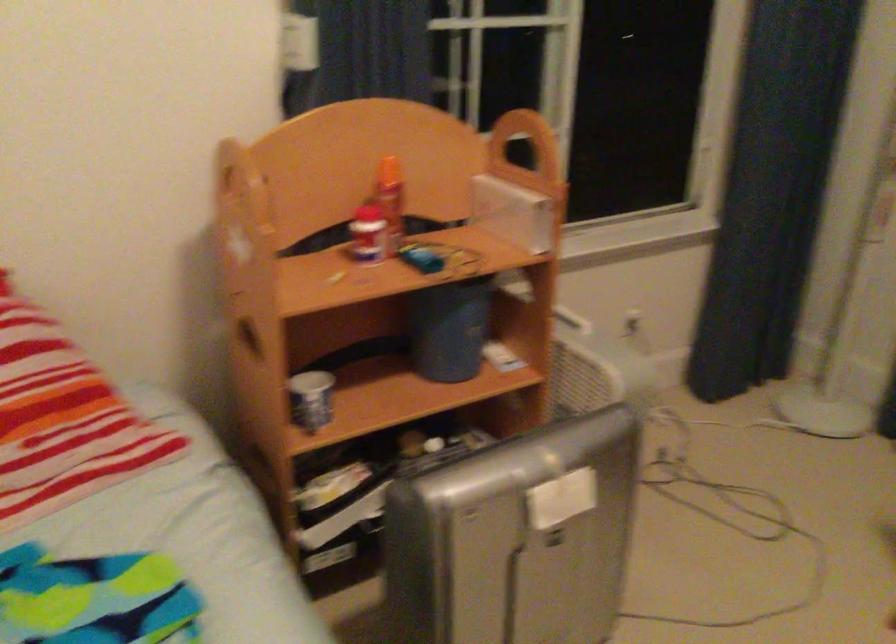
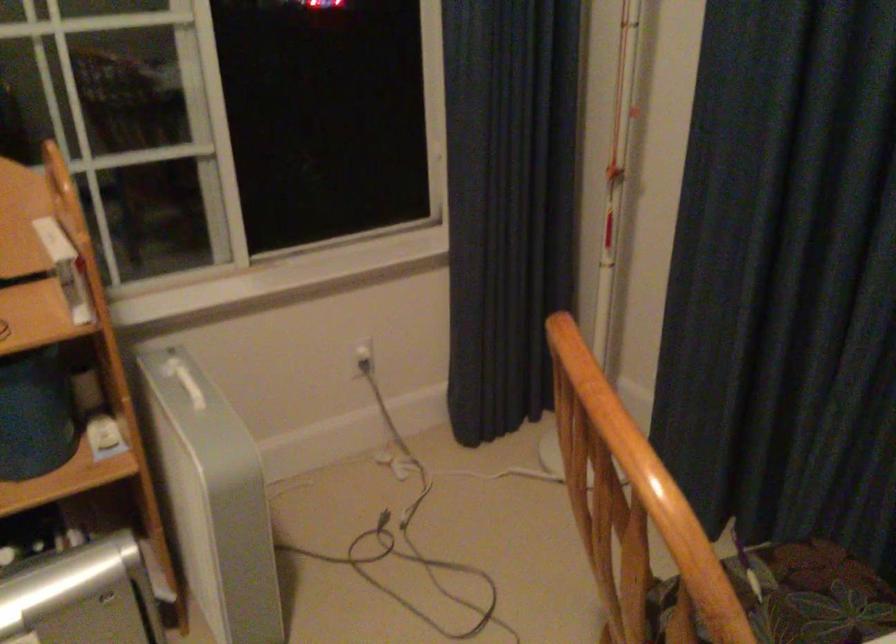
Find the pixel in the second image that matches the point at 617,402 in the first image.

(211, 498)